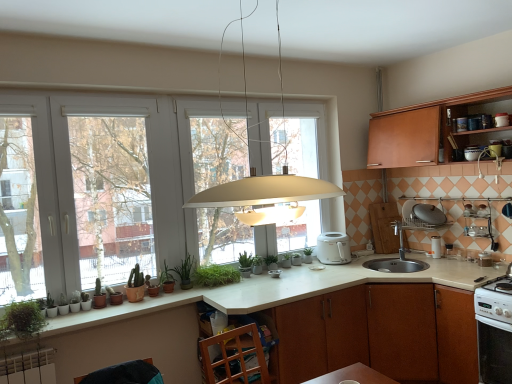
The image size is (512, 384). What are the coordinates of `vacant space in front of green matte plant at center, placed as the first plant when sorted from right to left` in the screenshot? It's located at (276, 268).